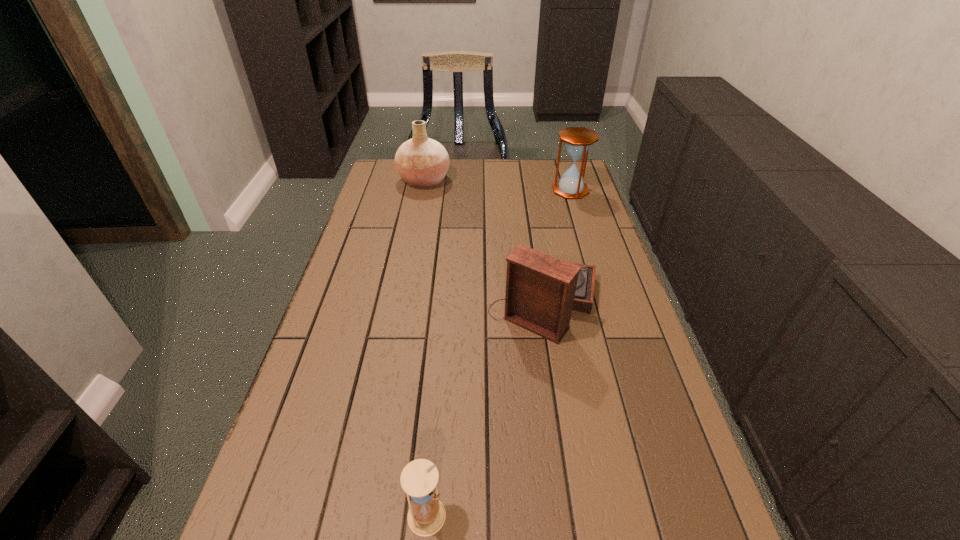
You are a GUI agent. You are given a task and a screenshot of the screen. Output one action in this format:
    pyautogui.click(x=<x>, y=<y>)
    Task: Click on the object identified as the third closest to the shorter hourglass
    This screenshot has height=540, width=960.
    Given the screenshot: What is the action you would take?
    pyautogui.click(x=577, y=140)

Where is `free space that satisfies the following two spatial constraints: 1. on the back side of the phonograph record; 2. to pour from the handle of the pottery`? This screenshot has height=540, width=960. free space that satisfies the following two spatial constraints: 1. on the back side of the phonograph record; 2. to pour from the handle of the pottery is located at coordinates (525, 180).

You are a GUI agent. You are given a task and a screenshot of the screen. Output one action in this format:
    pyautogui.click(x=<x>, y=<y>)
    Task: Click on the vacant area that satisfies the following two spatial constraints: 1. on the back side of the shortest object; 2. on the right side of the taller hourglass
    The width and height of the screenshot is (960, 540).
    Given the screenshot: What is the action you would take?
    pyautogui.click(x=455, y=190)

Locate an element on the screen. The image size is (960, 540). vacant area in the image that satisfies the following two spatial constraints: 1. on the back side of the nearest object; 2. on the left side of the second nearest object is located at coordinates (445, 302).

Locate an element on the screen. The image size is (960, 540). vacant space that satisfies the following two spatial constraints: 1. to pour from the handle of the pottery; 2. on the left side of the taller hourglass is located at coordinates (421, 190).

What are the coordinates of `vacant space that satisfies the following two spatial constraints: 1. to pour from the handle of the farther hourglass; 2. on the left side of the pottery` in the screenshot? It's located at (421, 190).

At what (x,y) coordinates should I click in order to perform the action: click on vacant position in the image that satisfies the following two spatial constraints: 1. on the back side of the right hourglass; 2. on the left side of the phonograph record. Please return your answer as a coordinate pair (x, y). Looking at the image, I should click on (527, 190).

This screenshot has height=540, width=960. I want to click on vacant space that satisfies the following two spatial constraints: 1. to pour from the handle of the pottery; 2. on the left side of the right hourglass, so click(421, 190).

Locate an element on the screen. free region that satisfies the following two spatial constraints: 1. on the back side of the phonograph record; 2. on the right side of the taller hourglass is located at coordinates (527, 190).